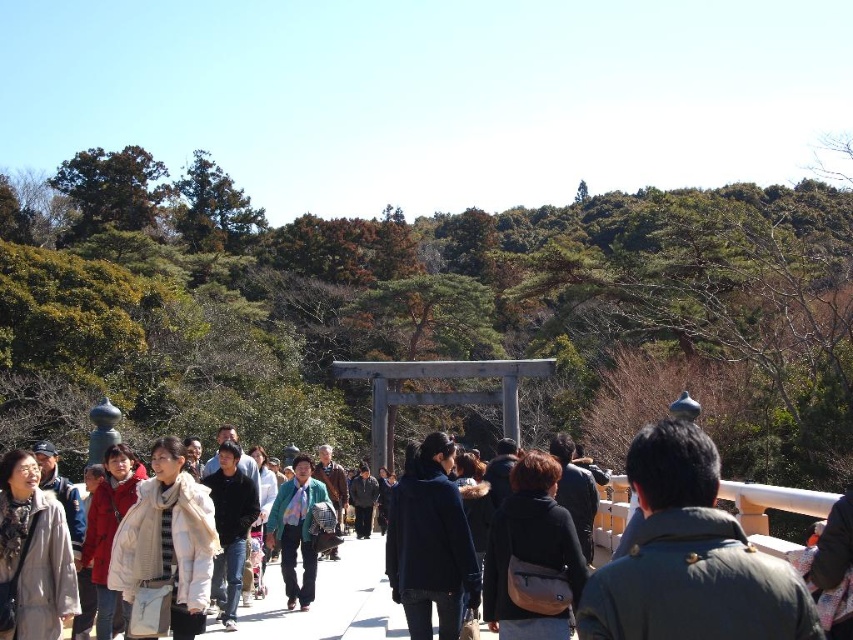
You are a photographer trying to capture both the green textured jacket at center and the dark gray wool coat at center in a single frame. Since both are at the center, you need to adjust your camera angle to ensure both are fully visible. Which clothing item might require you to zoom out more to include its entirety?

The green textured jacket at center is larger in size than the dark gray wool coat at center, so you would need to zoom out more to include the entirety of the green textured jacket at center.

Consider the image. You are a photographer standing on the pathway and want to take a photo of both the light brown wool coat at lower left and the green textured jacket at center. Which of the two clothing items is closer to your camera position?

The light brown wool coat at lower left is closer to the camera because it is in front of the green textured jacket at center.

You are a photographer standing at the lower left corner of the scene. You want to capture a photo that includes both the light brown wool coat at lower left and the green textured jacket at center. Which of these two items should you adjust your camera angle to focus on first to ensure both are in frame?

The light brown wool coat at lower left is shorter than the green textured jacket at center. To ensure both are in frame, focus on the shorter light brown wool coat at lower left first, then adjust to include the taller green textured jacket at center.